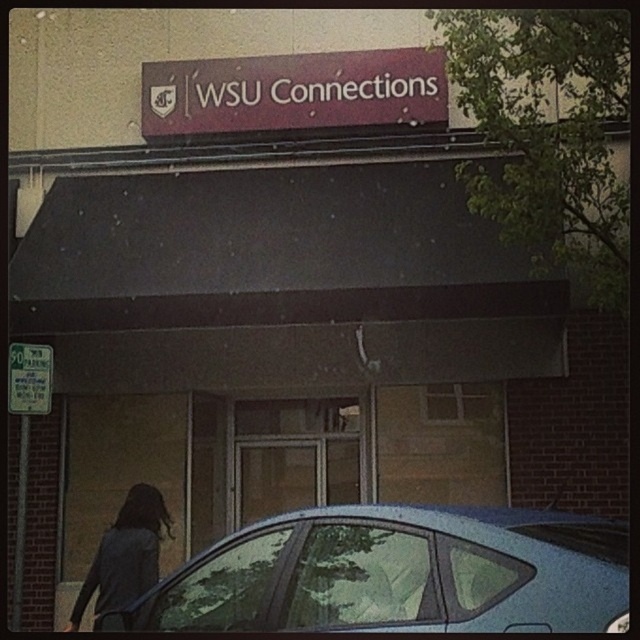
You are standing at the entrance of the WSU Connections building and notice two items near the parking area. You see the dark gray sweater at lower left and the green paper sign at left. Which item is taller?

The dark gray sweater at lower left is taller than the green paper sign at left.

You are standing in front of the WSU Connections building and notice the matte maroon sign at upper center and the dark gray sweater at lower left. Which object is positioned higher relative to the other?

The matte maroon sign at upper center is located above the dark gray sweater at lower left.